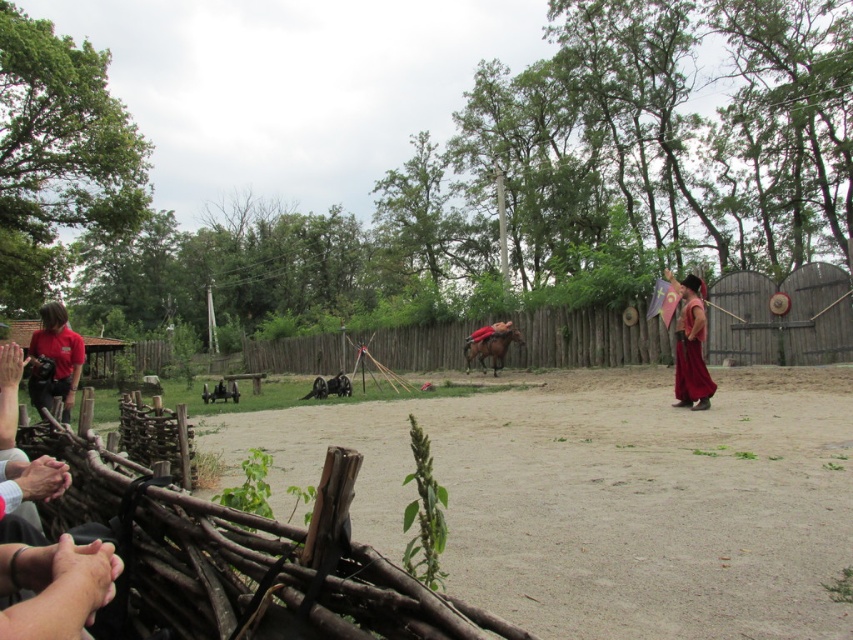
Does point (616, 372) lie in front of point (55, 337)?

No.

Which is in front, point (466, 528) or point (41, 401)?

Point (466, 528)

Identify the location of brown sandy ground at center. The height and width of the screenshot is (640, 853). (607, 497).

Consider the image. Can you confirm if brown sandy ground at center is positioned to the left of velvet maroon robe at right?

Correct, you'll find brown sandy ground at center to the left of velvet maroon robe at right.

Is brown sandy ground at center to the right of velvet maroon robe at right from the viewer's perspective?

Incorrect, brown sandy ground at center is not on the right side of velvet maroon robe at right.

I want to click on brown sandy ground at center, so click(x=607, y=497).

Based on the photo, is brown sandy ground at center to the left of brown glossy horse at center from the viewer's perspective?

Answer: No, brown sandy ground at center is not to the left of brown glossy horse at center.

The image size is (853, 640). What do you see at coordinates (607, 497) in the screenshot? I see `brown sandy ground at center` at bounding box center [607, 497].

The image size is (853, 640). What are the coordinates of `brown sandy ground at center` in the screenshot? It's located at (607, 497).

Find the location of a particular element. brown sandy ground at center is located at coordinates (607, 497).